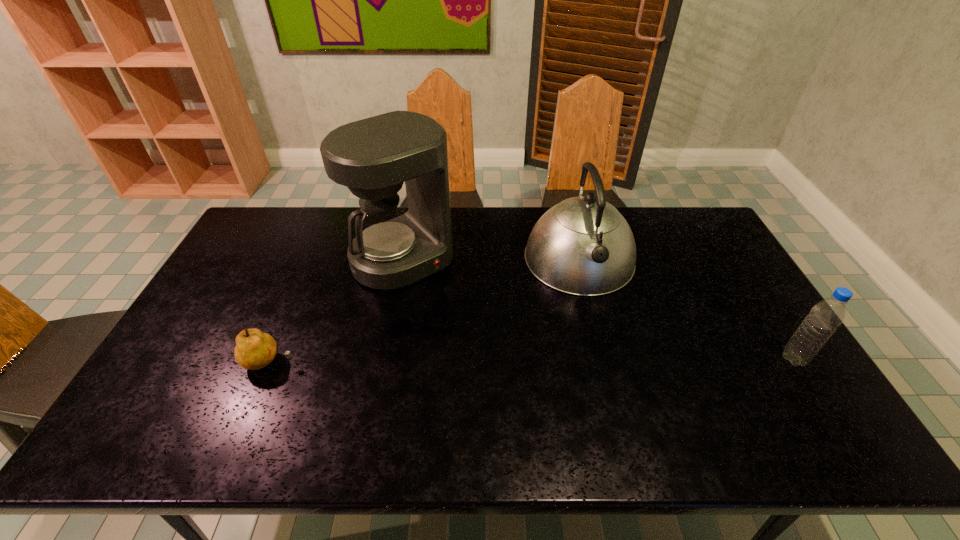
This screenshot has width=960, height=540. Identify the location of free spot between the second shortest object and the pear. (532, 360).

This screenshot has width=960, height=540. What are the coordinates of `unoccupied area between the second tallest object and the shortest object` in the screenshot? It's located at (424, 310).

This screenshot has height=540, width=960. Identify the location of vacant area between the third tallest object and the kettle. (686, 309).

Image resolution: width=960 pixels, height=540 pixels. Find the location of `free space that is in between the water bottle and the third object from left to right`. free space that is in between the water bottle and the third object from left to right is located at coordinates (686, 309).

Image resolution: width=960 pixels, height=540 pixels. In order to click on vacant area that lies between the kettle and the shortest object in this screenshot , I will do `click(424, 310)`.

Locate an element on the screen. This screenshot has height=540, width=960. object that ranks as the second closest to the second tallest object is located at coordinates (823, 319).

Find the location of a particular element. the third closest object relative to the rightmost object is located at coordinates (254, 349).

This screenshot has height=540, width=960. Identify the location of vacant space that satisfies the following two spatial constraints: 1. on the front side of the rightmost object; 2. on the right side of the second object from left to right. (384, 359).